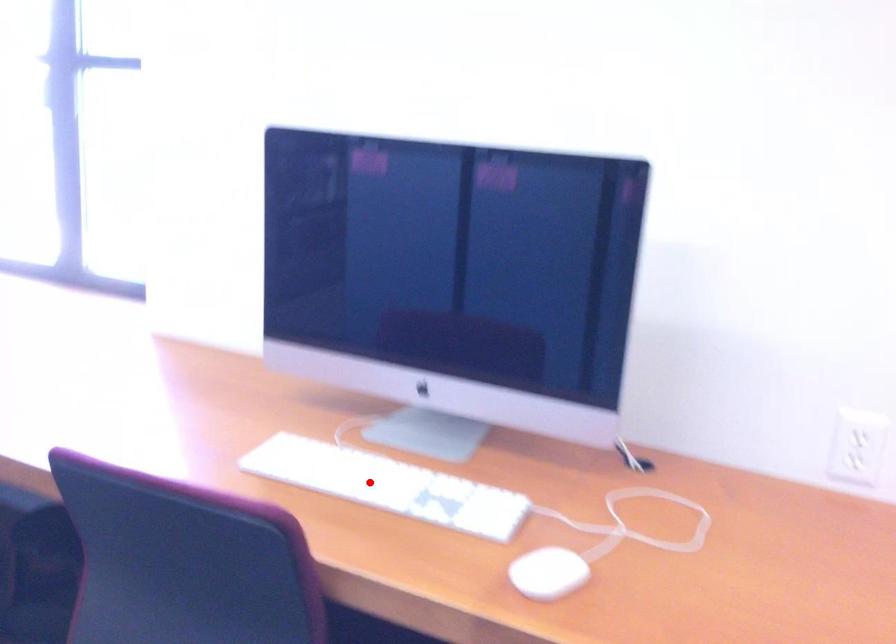
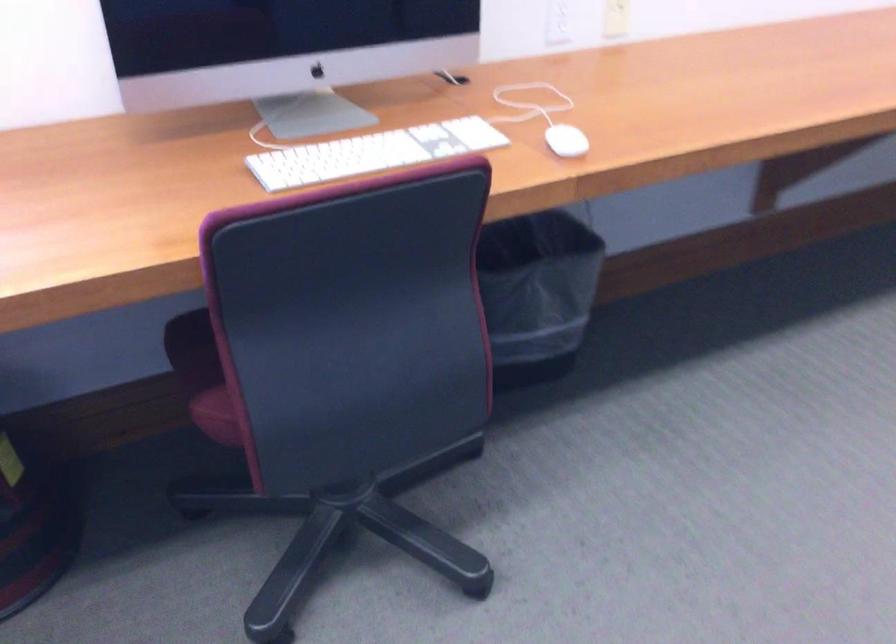
Question: A red point is marked in image1. In image2, is the corresponding 3D point closer to the camera or farther? Reply with the corresponding letter.

Choices:
 (A) The corresponding 3D point is closer.
 (B) The corresponding 3D point is farther.

Answer: (B)